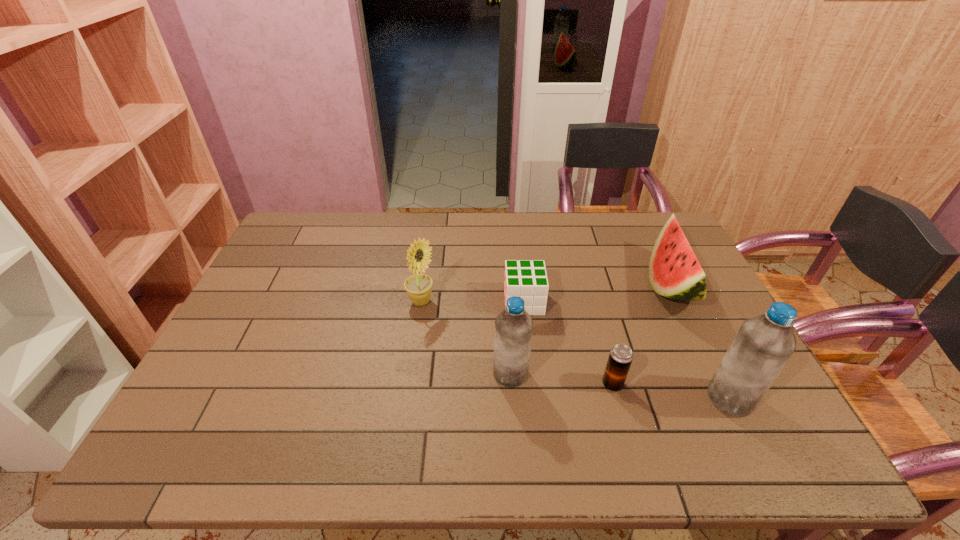
You are a GUI agent. You are given a task and a screenshot of the screen. Output one action in this format:
    pyautogui.click(x=<x>, y=<y>)
    Task: Click on the vacant space located on the red face of the cube
    
    Given the screenshot: What is the action you would take?
    pyautogui.click(x=399, y=302)

Find the location of a particular element. The image size is (960, 540). free region located 0.290m on the red face of the cube is located at coordinates (406, 302).

Image resolution: width=960 pixels, height=540 pixels. What are the coordinates of `free space located on the face of the leftmost object` in the screenshot? It's located at point(493,302).

I want to click on free space located 0.210m on the left of the fourth object from left to right, so click(x=516, y=384).

Identify the location of vacant space located on the outer rind of the watermelon. The image size is (960, 540). (609, 286).

You are a GUI agent. You are given a task and a screenshot of the screen. Output one action in this format:
    pyautogui.click(x=<x>, y=<y>)
    Task: Click on the vacant region located 0.210m on the outer rind of the watermelon
    This screenshot has width=960, height=540.
    Given the screenshot: What is the action you would take?
    pyautogui.click(x=579, y=286)

The image size is (960, 540). I want to click on vacant space located 0.170m on the outer rind of the watermelon, so click(592, 286).

Where is `object that is at the far edge`? This screenshot has height=540, width=960. object that is at the far edge is located at coordinates (674, 272).

This screenshot has width=960, height=540. Find the location of `beer can that is at the near edge`. beer can that is at the near edge is located at coordinates (620, 358).

Locate an element on the screen. The width and height of the screenshot is (960, 540). water bottle that is at the right edge is located at coordinates (763, 345).